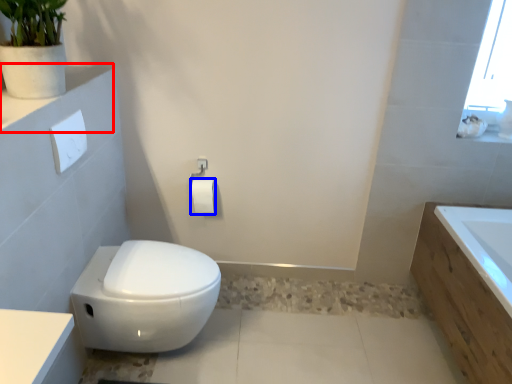
Question: Which object appears closest to the camera in this image, ledge (highlighted by a red box) or toilet paper (highlighted by a blue box)?

Choices:
 (A) ledge
 (B) toilet paper

Answer: (A)